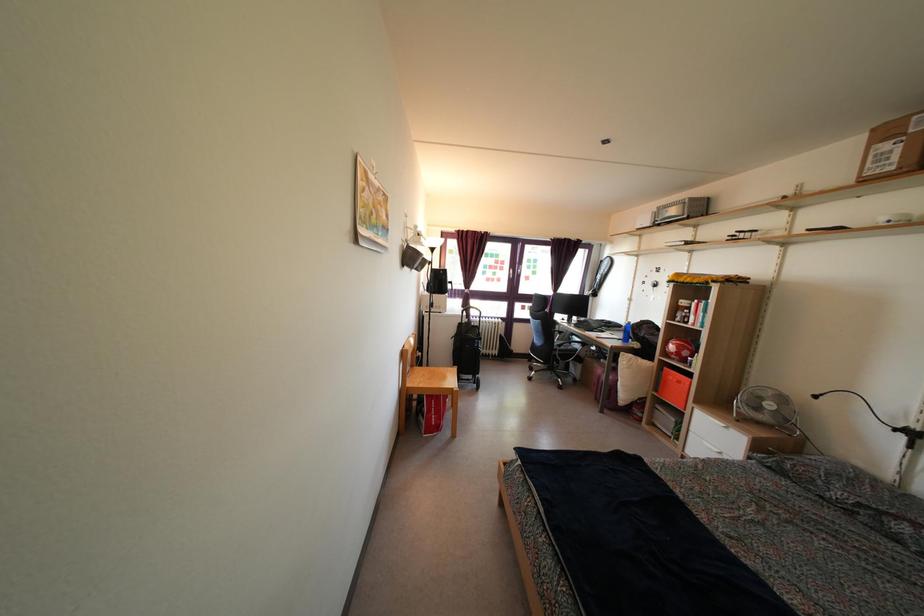
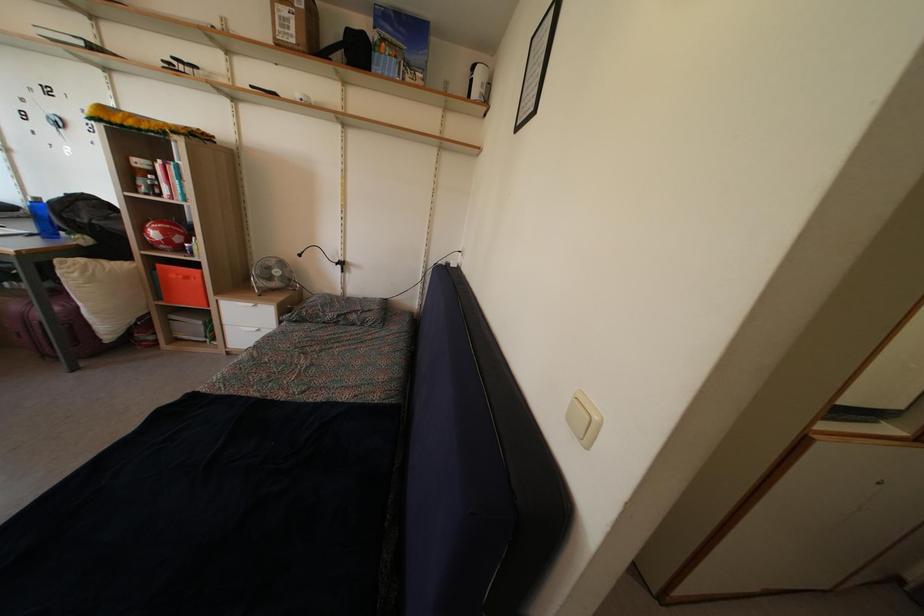
Find the pixel in the second image that matches point (647, 367) in the first image.

(116, 268)